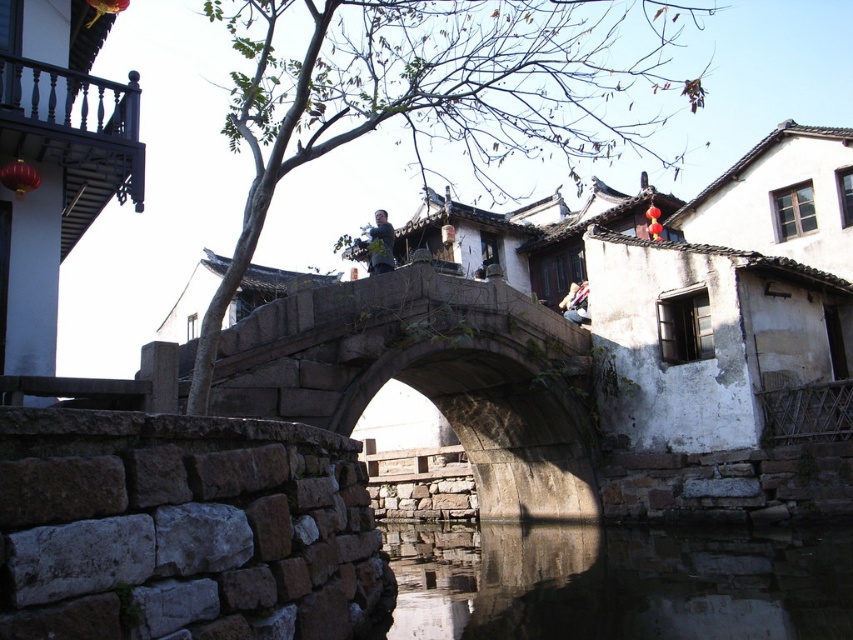
Is smooth stone water at center above light blue denim jacket at upper center?

No, smooth stone water at center is not above light blue denim jacket at upper center.

Which is more to the right, smooth stone water at center or light blue denim jacket at upper center?

light blue denim jacket at upper center is more to the right.

Which is in front, point (440, 568) or point (583, 285)?

Positioned in front is point (440, 568).

You are a GUI agent. You are given a task and a screenshot of the screen. Output one action in this format:
    pyautogui.click(x=<x>, y=<y>)
    Task: Click on the smooth stone water at center
    
    Given the screenshot: What is the action you would take?
    pyautogui.click(x=619, y=582)

Does stone bridge at center have a greater width compared to light blue denim jacket at upper center?

Yes.

Does stone bridge at center appear on the right side of light blue denim jacket at upper center?

In fact, stone bridge at center is to the left of light blue denim jacket at upper center.

Measure the distance between stone bridge at center and camera.

38.32 meters

I want to click on stone bridge at center, so click(x=430, y=378).

Measure the distance between stone bridge at center and camera.

stone bridge at center is 125.72 feet away from camera.

Between point (467, 410) and point (366, 243), which one is positioned behind?

The point (366, 243) is behind.

The width and height of the screenshot is (853, 640). I want to click on stone bridge at center, so click(430, 378).